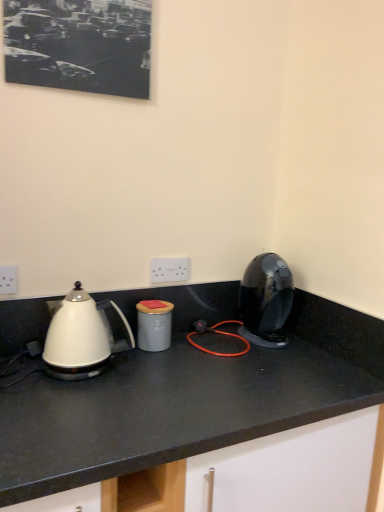
Find the location of a particular element. The image size is (384, 512). free spot above white glossy countertop at center (from a real-world perspective) is located at coordinates (196, 369).